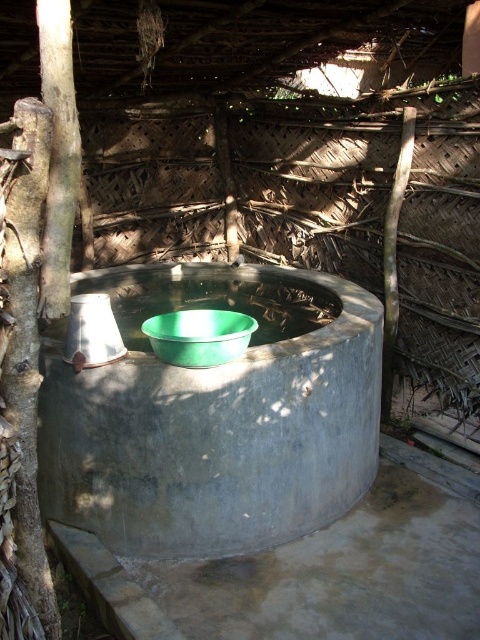
Is point (156, 502) in front of point (236, 339)?

No, it is not.

Who is higher up, gray concrete basin at center or green plastic basin at center?

green plastic basin at center

Which is in front, point (207, 536) or point (165, 317)?

Point (165, 317) is in front.

Locate an element on the screen. This screenshot has height=640, width=480. gray concrete basin at center is located at coordinates (215, 416).